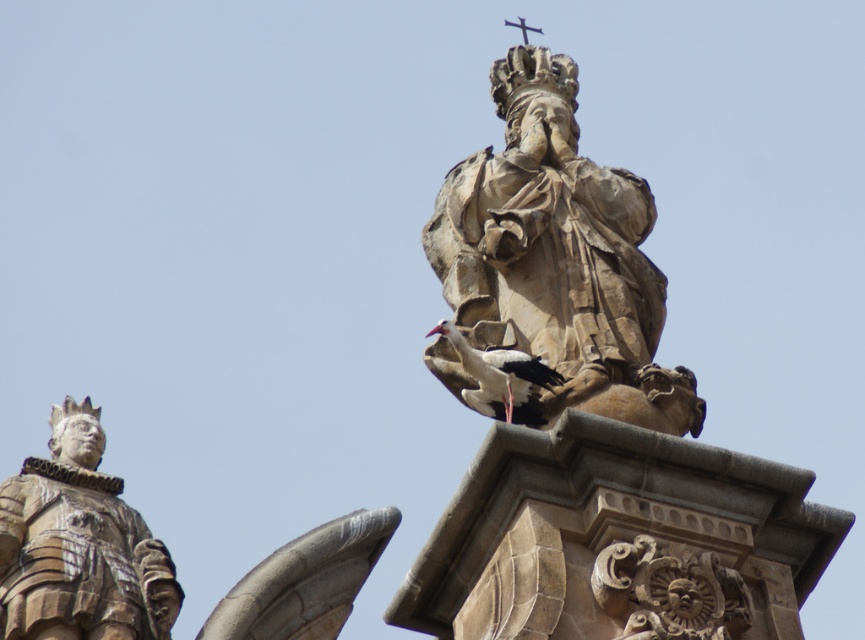
You are an art conservator assessing the statues. Which statue has a greater width between the brown stone statue at left and the carved stone statue at left?

The brown stone statue at left has a greater width than the carved stone statue at left according to the description provided.

Based on the photo, you are a tourist standing in front of the two stone statues. You want to take a photo that includes both statues in the frame. The camera you have can only focus on objects within a 0.5 unit radius from the point you choose. If you choose to focus on the point marked at coordinates point (558, 257), will both statues be within the focus range?

The point (558, 257) marks the brown stone statue at center. Since the camera can focus within a 0.5 unit radius, both statues must be within 0.5 units from this point to be in focus. However, the description does not provide specific distances between the statues and the point, so it is impossible to determine if both are within the focus range based on the given information.